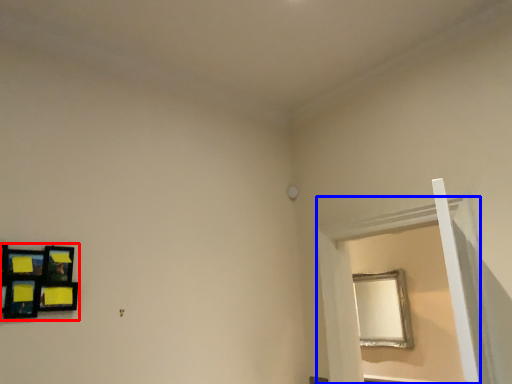
Question: Which object is closer to the camera taking this photo, picture frame (highlighted by a red box) or window frame (highlighted by a blue box)?

Choices:
 (A) picture frame
 (B) window frame

Answer: (A)